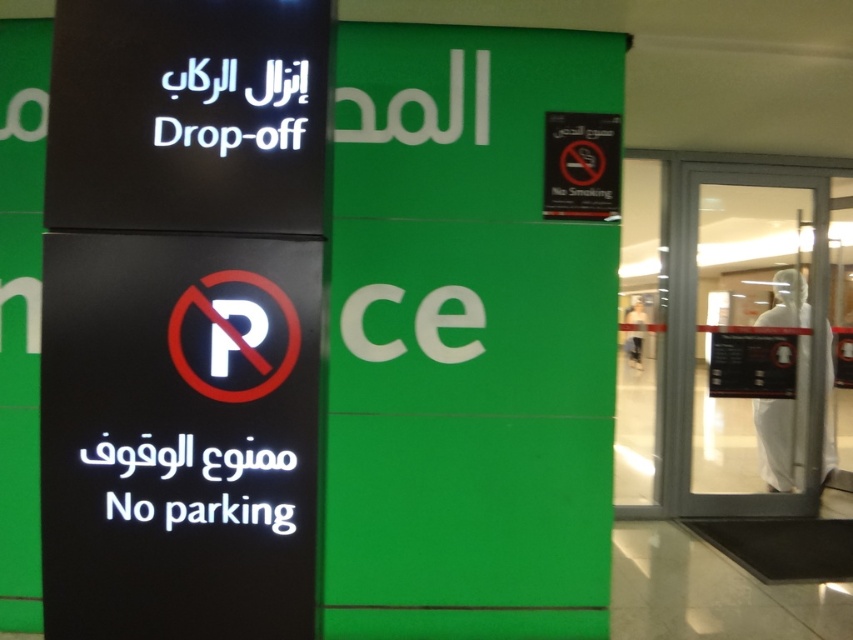
Question: Which object appears closest to the camera in this image?

Choices:
 (A) black plastic sign at upper right
 (B) black glossy sign at center
 (C) black glossy sign at upper left

Answer: (C)

Question: Is black glossy sign at center bigger than black plastic sign at upper right?

Choices:
 (A) no
 (B) yes

Answer: (B)

Question: Which object is positioned closest to the black plastic sign at upper right?

Choices:
 (A) black glossy sign at upper left
 (B) black glossy sign at center

Answer: (A)

Question: Can you confirm if black glossy sign at center is positioned to the left of black glossy sign at upper left?

Choices:
 (A) yes
 (B) no

Answer: (A)

Question: Does black glossy sign at center have a greater width compared to black glossy sign at upper left?

Choices:
 (A) no
 (B) yes

Answer: (A)

Question: Which of the following is the closest to the observer?

Choices:
 (A) black glossy sign at upper left
 (B) black plastic sign at upper right
 (C) black glossy sign at center

Answer: (A)